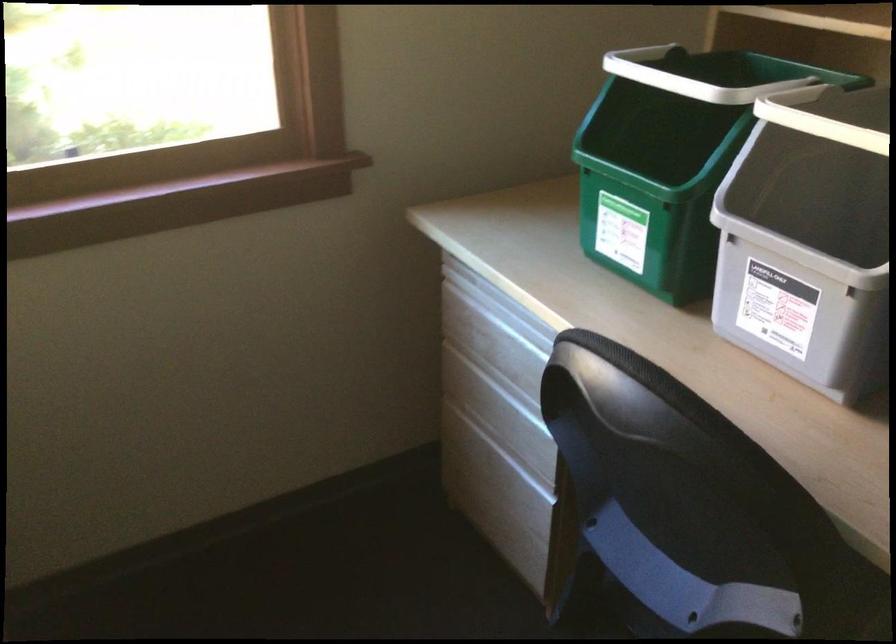
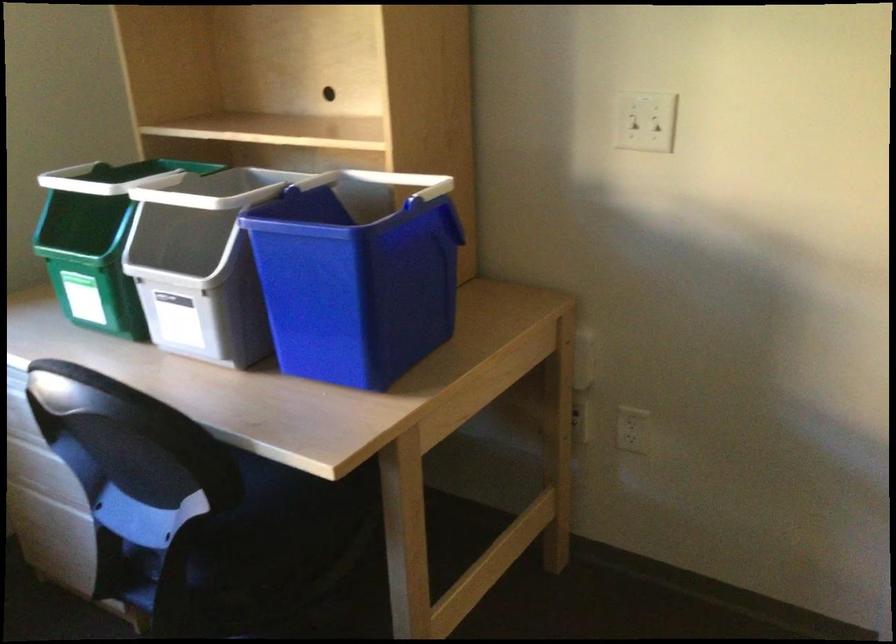
Locate, in the second image, the point that corresponds to pixel 684 68 in the first image.

(116, 178)